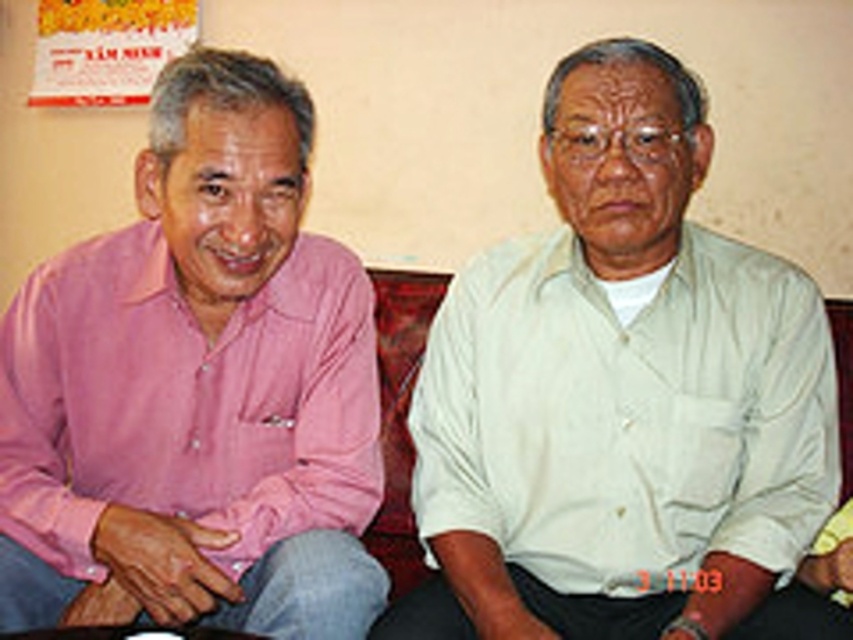
Can you confirm if pink cotton shirt at left is positioned below light beige cotton shirt at right?

No.

Does pink cotton shirt at left have a greater height compared to light beige cotton shirt at right?

Yes, pink cotton shirt at left is taller than light beige cotton shirt at right.

I want to click on pink cotton shirt at left, so click(x=198, y=387).

In order to click on pink cotton shirt at left in this screenshot , I will do `click(198, 387)`.